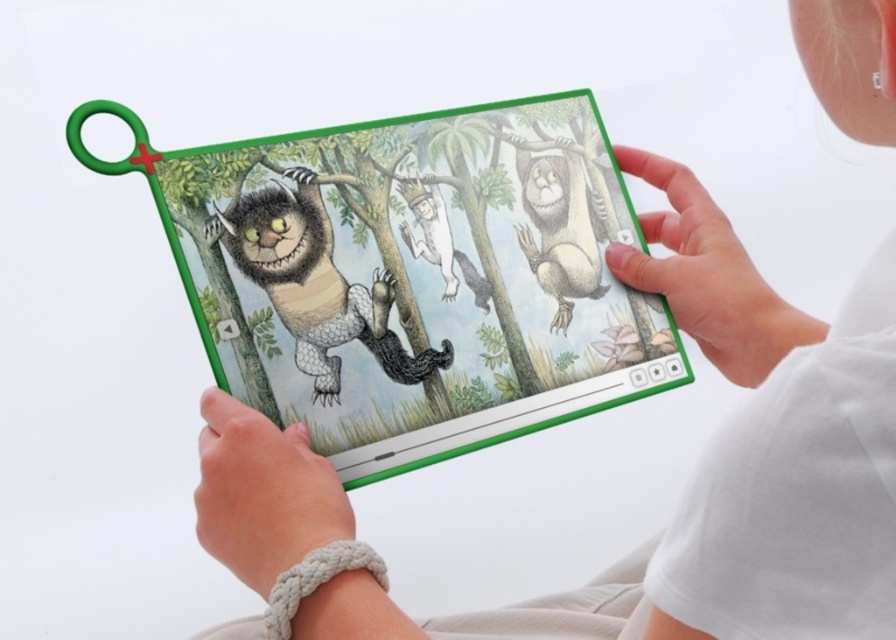
Does white matte hand at lower center come in front of white paper crown at center?

That is True.

Locate an element on the screen. This screenshot has height=640, width=896. white matte hand at lower center is located at coordinates (263, 493).

Which is behind, point (590, 264) or point (325, 339)?

The point (590, 264) is behind.

Who is positioned more to the right, green plastic tablet at center or shaggy fur cat at left?

green plastic tablet at center

The width and height of the screenshot is (896, 640). Find the location of `green plastic tablet at center`. green plastic tablet at center is located at coordinates (411, 275).

Consider the image. Who is taller, green plastic tablet at center or white matte hand at upper right?

With more height is green plastic tablet at center.

Which is in front, point (228, 310) or point (668, 184)?

Point (228, 310)

Where is `green plastic tablet at center`? green plastic tablet at center is located at coordinates (411, 275).